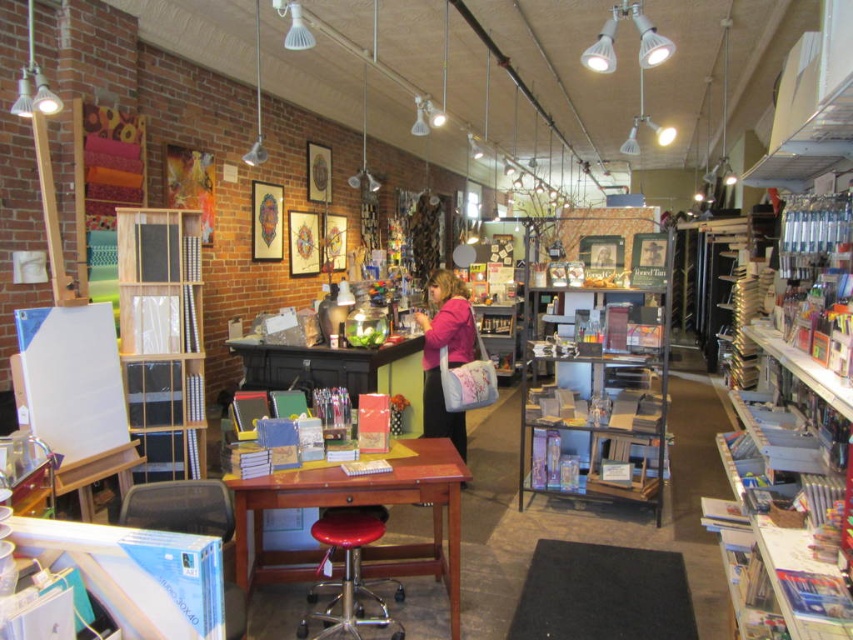
You are an artist who just entered the store and needs to retrieve supplies from both the white cardboard bookshelf at right and the metallic gray bookshelf at center. If you start at the entrance near the window, which bookshelf should you approach first to minimize the distance walked?

The metallic gray bookshelf at center is closer to the entrance near the window than the white cardboard bookshelf at right, so you should approach the metallic gray bookshelf at center first to minimize the distance walked.

You are an artist who needs to choose between the white cardboard bookshelf at right and the metallic gray bookshelf at center to place your large art supplies. Based on their widths, which one do you think can accommodate your items better?

The white cardboard bookshelf at right might be wider than metallic gray bookshelf at center, so it can accommodate larger art supplies better.